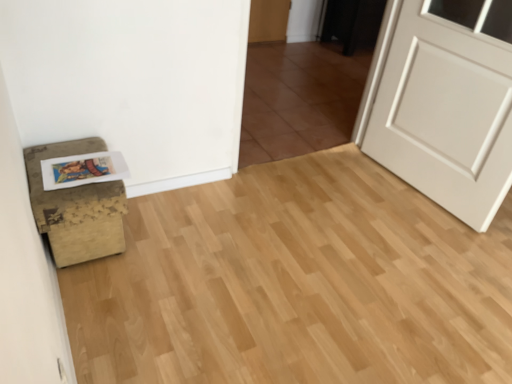
This screenshot has height=384, width=512. I want to click on unoccupied region to the right of distressed brown ottoman at lower left, so tap(160, 245).